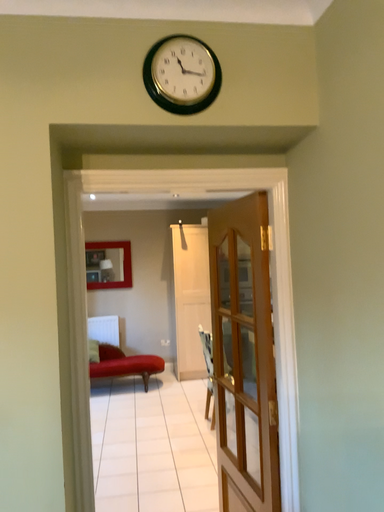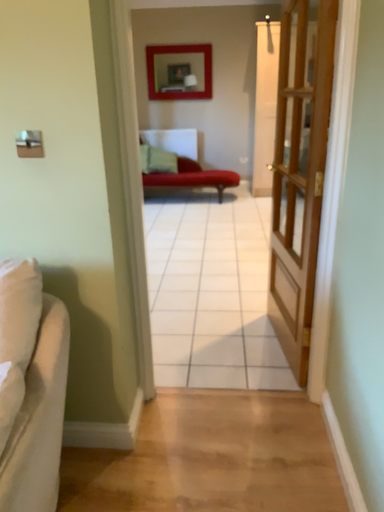
Question: Which way did the camera rotate in the video?

Choices:
 (A) rotated left
 (B) rotated right

Answer: (A)